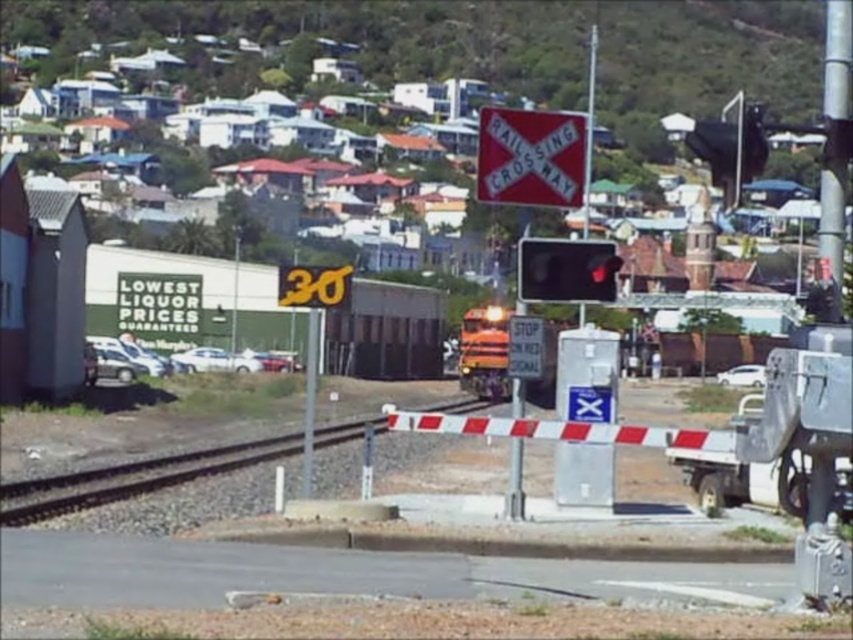
Can you confirm if red plastic railroad crossing sign at center is positioned below white plastic stop sign at center?

Incorrect, red plastic railroad crossing sign at center is not positioned below white plastic stop sign at center.

Is red plastic railroad crossing sign at center to the right of white plastic stop sign at center from the viewer's perspective?

In fact, red plastic railroad crossing sign at center is to the left of white plastic stop sign at center.

Find the location of a particular element. red plastic railroad crossing sign at center is located at coordinates (531, 157).

Is matte black traffic light at center smaller than metallic traffic light at center?

Yes, matte black traffic light at center is smaller than metallic traffic light at center.

Between matte black traffic light at center and metallic traffic light at center, which one is positioned lower?

metallic traffic light at center is lower down.

Is point (527, 244) more distant than point (512, 410)?

No, it is in front of (512, 410).

Find the location of a particular element. matte black traffic light at center is located at coordinates (566, 269).

Does smooth metal tracks at center appear on the right side of red plastic railroad crossing sign at center?

Incorrect, smooth metal tracks at center is not on the right side of red plastic railroad crossing sign at center.

Is point (329, 428) farther from camera compared to point (564, 144)?

Yes, it is behind point (564, 144).

Identify the location of smooth metal tracks at center. (132, 477).